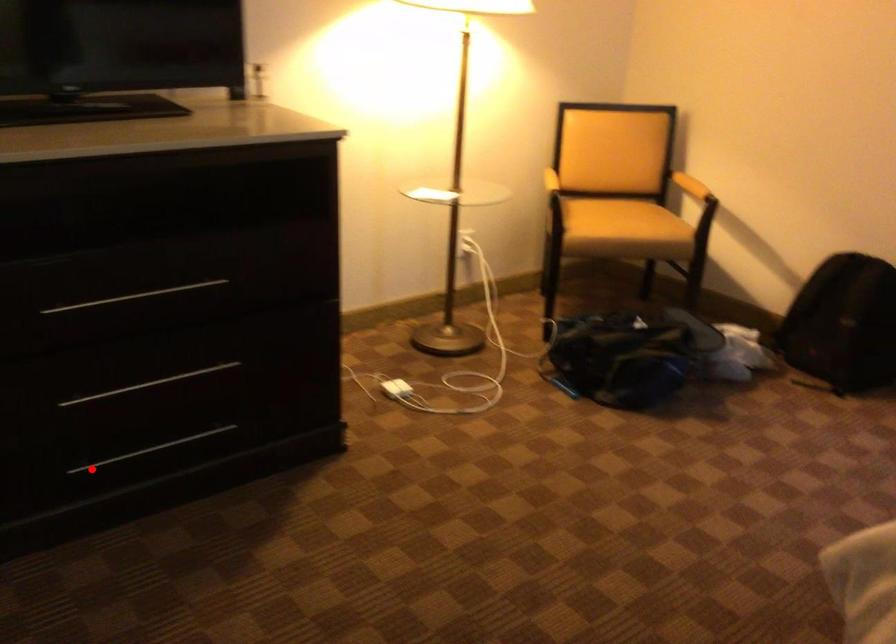
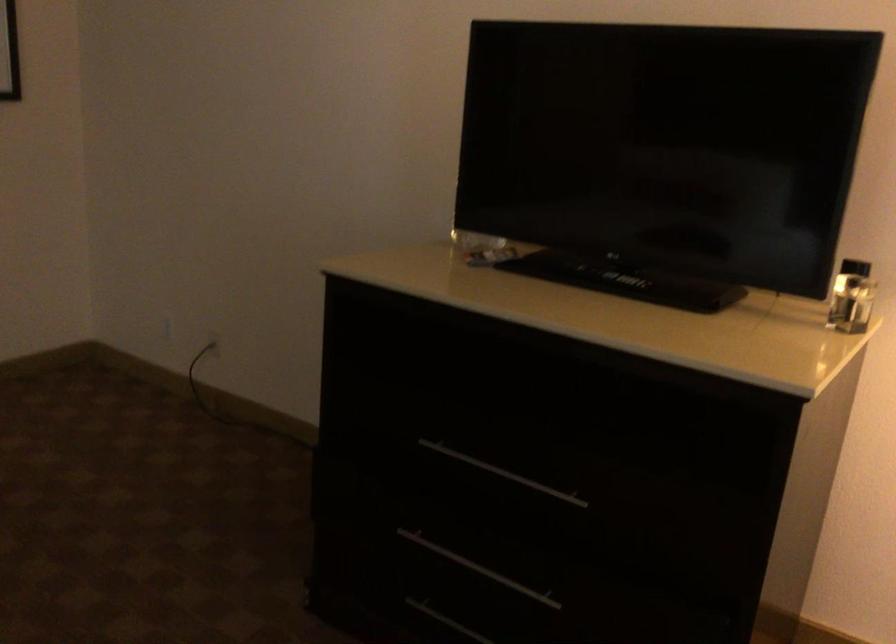
Find the pixel in the second image that matches the highlighted location in the first image.

(446, 621)